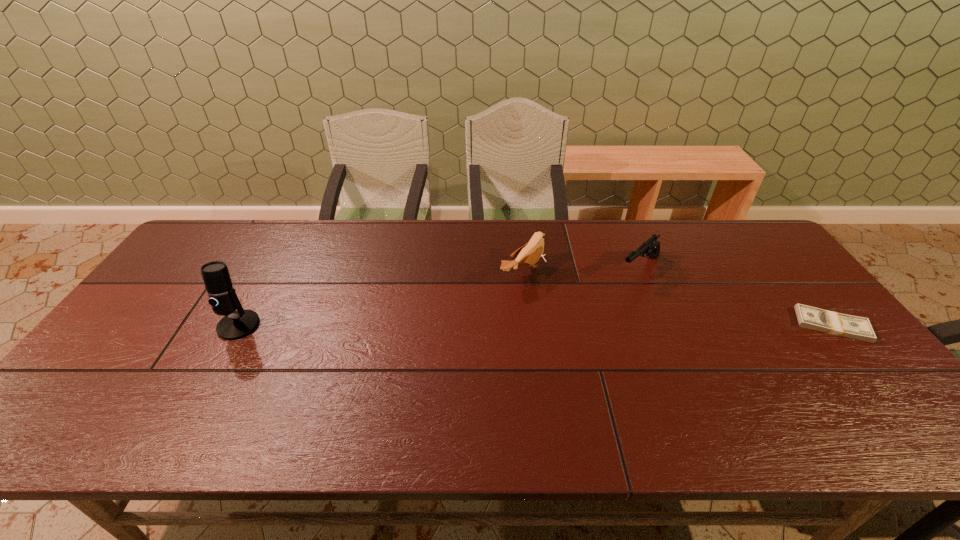
Locate an element on the screen. the leftmost object is located at coordinates (234, 325).

Locate an element on the screen. microphone is located at coordinates (234, 325).

The image size is (960, 540). Find the location of `the rightmost object`. the rightmost object is located at coordinates (808, 317).

Identify the location of the shortest object. (808, 317).

Find the location of a particular element. The height and width of the screenshot is (540, 960). the third object from left to right is located at coordinates (651, 247).

This screenshot has height=540, width=960. I want to click on bird, so click(x=530, y=253).

Where is `vacant region located 0.080m on the left of the leftmost object`? This screenshot has height=540, width=960. vacant region located 0.080m on the left of the leftmost object is located at coordinates (189, 326).

Locate an element on the screen. This screenshot has width=960, height=540. vacant area situated on the back of the shortest object is located at coordinates (799, 284).

Find the location of a particular element. free region located at the end of the barrel of the third object from left to right is located at coordinates (565, 328).

Where is `free space located at the end of the barrel of the third object from left to right`? The width and height of the screenshot is (960, 540). free space located at the end of the barrel of the third object from left to right is located at coordinates (596, 303).